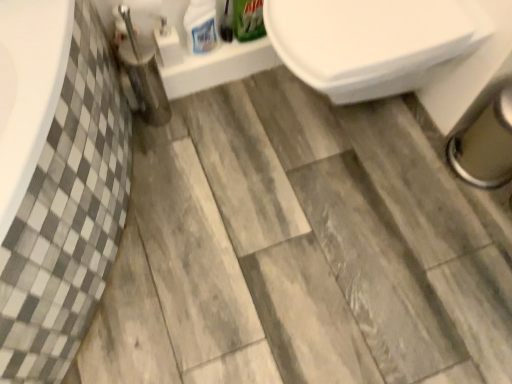
Where is `vacant area situated below white glossy toilet at upper right (from a real-world perspective)`? The height and width of the screenshot is (384, 512). vacant area situated below white glossy toilet at upper right (from a real-world perspective) is located at coordinates (331, 118).